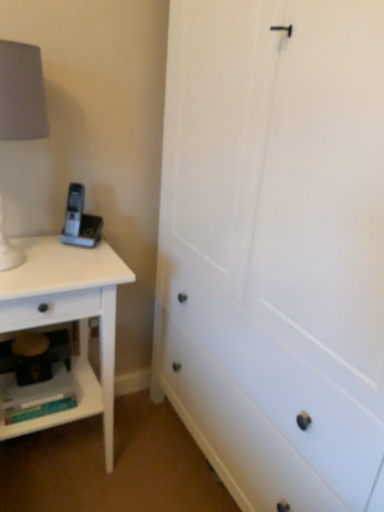
You are a GUI agent. You are given a task and a screenshot of the screen. Output one action in this format:
    pyautogui.click(x=<x>, y=<y>)
    Task: Click on the empty space that is ontop of matte plastic shelf at lower left (from a real-world perspective)
    The height and width of the screenshot is (512, 384).
    Given the screenshot: What is the action you would take?
    pyautogui.click(x=33, y=379)